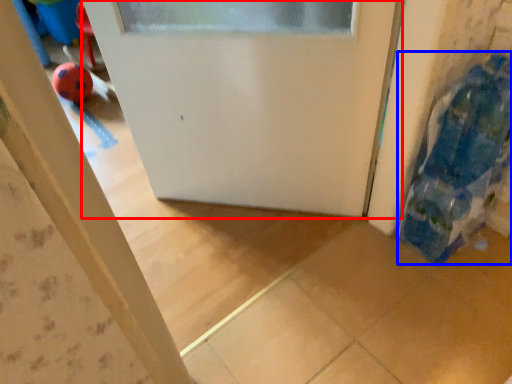
Question: Which point is closer to the camera, door (highlighted by a red box) or toy (highlighted by a blue box)?

Choices:
 (A) door
 (B) toy

Answer: (B)